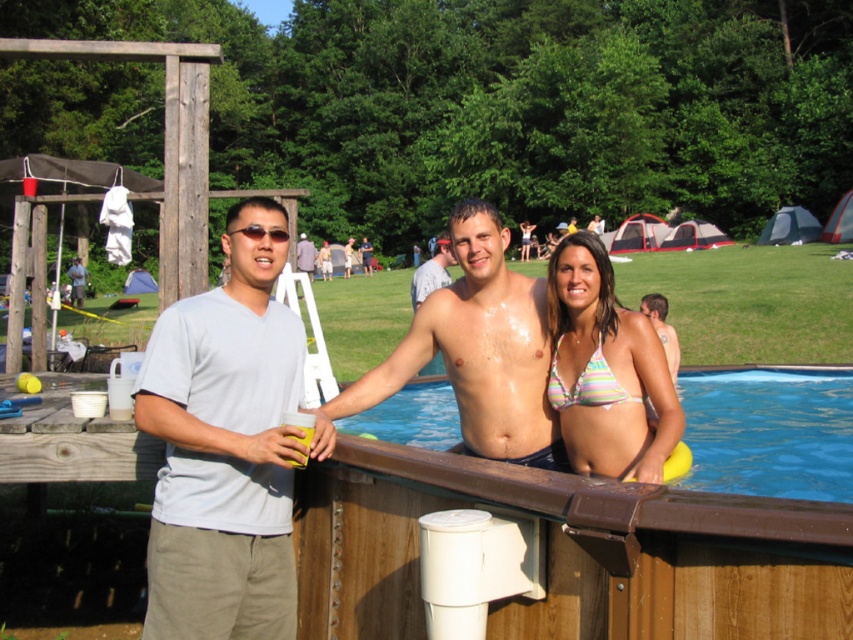
Identify the location of gray cotton t-shirt at left. (225, 445).

Can you confirm if gray cotton t-shirt at left is positioned to the left of blue wooden swimming pool at center?

Yes, gray cotton t-shirt at left is to the left of blue wooden swimming pool at center.

Describe the element at coordinates (225, 445) in the screenshot. I see `gray cotton t-shirt at left` at that location.

I want to click on gray cotton t-shirt at left, so click(x=225, y=445).

Between point (495, 420) and point (440, 436), which one is positioned behind?

The point (440, 436) is behind.

Find the location of `shiny skin at center`. shiny skin at center is located at coordinates (479, 349).

Can you confirm if shiny skin at center is thinner than smooth skin torso at center?

Yes.

Consider the image. Who is positioned more to the left, shiny skin at center or smooth skin torso at center?

Positioned to the left is shiny skin at center.

Identify the location of shiny skin at center. (479, 349).